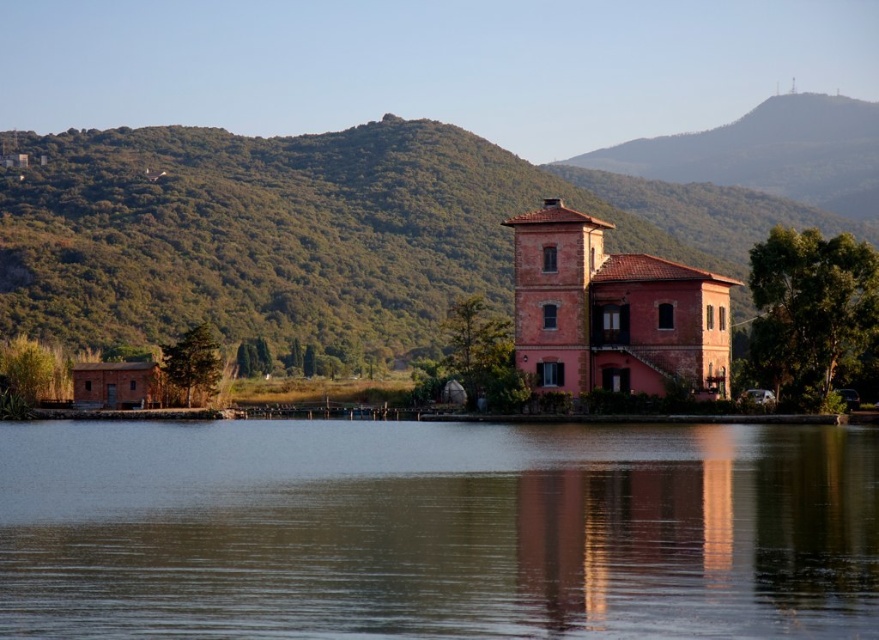
Is point (415, 636) positioned behind point (351, 163)?

No, (415, 636) is closer to viewer.

Can you confirm if smooth water at center is wider than green textured hillside at upper left?

No, smooth water at center is not wider than green textured hillside at upper left.

Is point (45, 468) more distant than point (68, 264)?

No, it is in front of (68, 264).

Where is `smooth water at center`? The image size is (879, 640). smooth water at center is located at coordinates (436, 531).

Who is positioned more to the right, green textured hillside at upper left or matte brick house at center?

From the viewer's perspective, matte brick house at center appears more on the right side.

At what (x,y) coordinates should I click in order to perform the action: click on green textured hillside at upper left. Please return your answer as a coordinate pair (x, y). Looking at the image, I should click on (315, 230).

I want to click on green textured hillside at upper left, so click(x=315, y=230).

Does smooth water at center have a lesser width compared to matte brick house at center?

In fact, smooth water at center might be wider than matte brick house at center.

Can you confirm if smooth water at center is positioned below matte brick house at center?

Correct, smooth water at center is located below matte brick house at center.

Describe the element at coordinates (436, 531) in the screenshot. I see `smooth water at center` at that location.

Where is `smooth water at center`? smooth water at center is located at coordinates (436, 531).